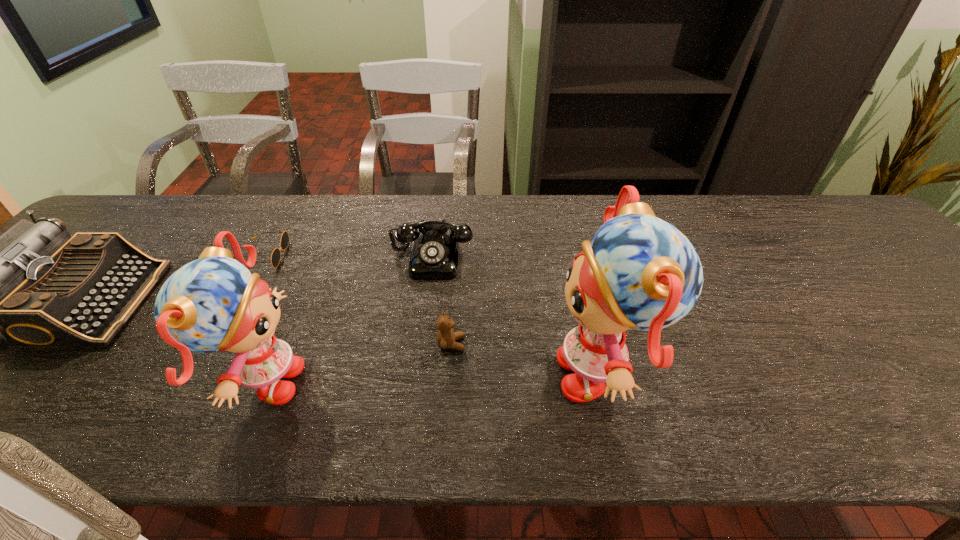
The width and height of the screenshot is (960, 540). I want to click on the left doll, so click(214, 303).

At what (x,y) coordinates should I click in order to perform the action: click on the shorter doll. Please return your answer as a coordinate pair (x, y). The width and height of the screenshot is (960, 540). Looking at the image, I should click on (214, 303).

This screenshot has width=960, height=540. Find the location of `the rightmost object`. the rightmost object is located at coordinates tap(639, 272).

The image size is (960, 540). In order to click on the taller doll in this screenshot , I will do `click(639, 272)`.

Locate an element on the screen. The height and width of the screenshot is (540, 960). telephone is located at coordinates (434, 256).

Locate an element on the screen. sunglasses is located at coordinates (276, 254).

Locate an element on the screen. teddy bear is located at coordinates (446, 337).

Locate an element on the screen. The width and height of the screenshot is (960, 540). vacant space located on the face of the second tallest object is located at coordinates (399, 384).

Locate an element on the screen. The height and width of the screenshot is (540, 960). vacant space located 0.120m on the face of the rightmost object is located at coordinates (493, 373).

Identify the location of vacant region located 0.350m on the face of the rightmost object. (382, 373).